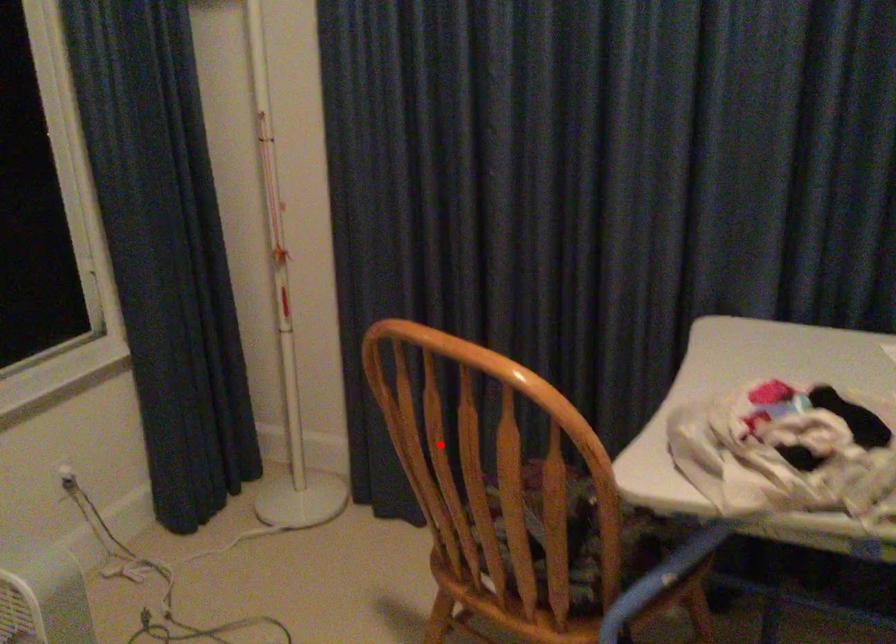
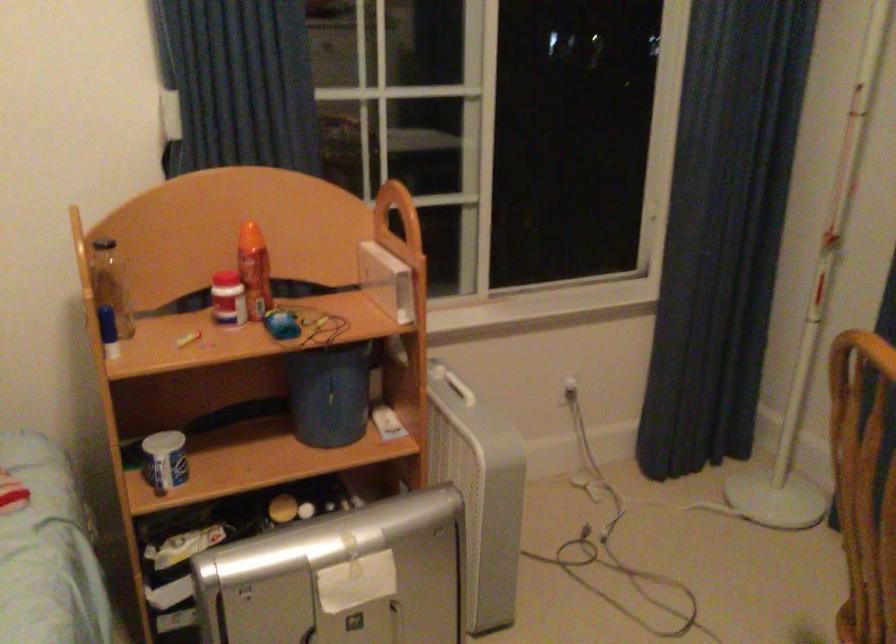
In the second image, find the point that corresponds to the highlighted location in the first image.

(864, 484)